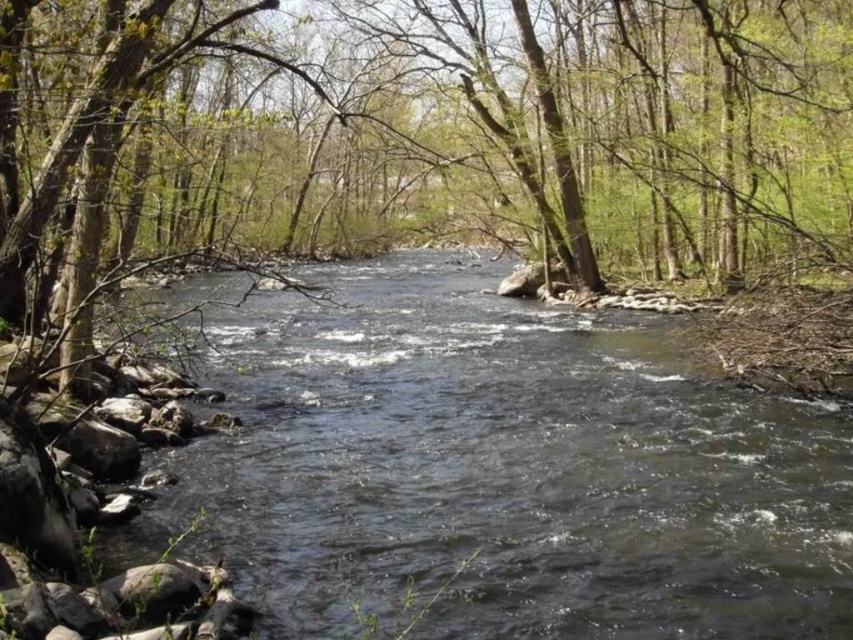
Question: Which object appears closest to the camera in this image?

Choices:
 (A) brown wood tree at center
 (B) clear water stream at center

Answer: (B)

Question: Can you confirm if brown wood tree at center is positioned to the left of clear water stream at center?

Choices:
 (A) yes
 (B) no

Answer: (A)

Question: Is brown wood tree at center positioned at the back of clear water stream at center?

Choices:
 (A) yes
 (B) no

Answer: (A)

Question: Can you confirm if brown wood tree at center is smaller than clear water stream at center?

Choices:
 (A) no
 (B) yes

Answer: (A)

Question: Among these objects, which one is nearest to the camera?

Choices:
 (A) clear water stream at center
 (B) brown wood tree at center

Answer: (A)